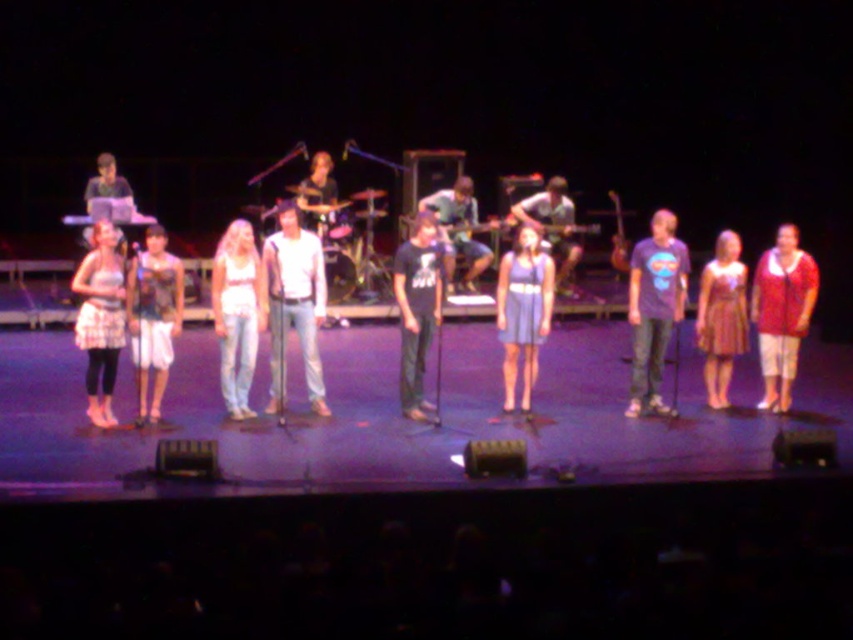
Question: Which object appears closest to the camera in this image?

Choices:
 (A) matte black guitar at center
 (B) black cotton t-shirt at center
 (C) matte purple dress at center
 (D) white textured skirt at left

Answer: (D)

Question: Which object appears closest to the camera in this image?

Choices:
 (A) white textured skirt at left
 (B) matte black tank top at left
 (C) black cotton t-shirt at center

Answer: (A)

Question: Does white denim jeans at center lie in front of matte purple dress at center?

Choices:
 (A) no
 (B) yes

Answer: (B)

Question: Does matte black guitar at center have a lesser width compared to shiny purple dress at right?

Choices:
 (A) yes
 (B) no

Answer: (B)

Question: Does matte black guitar at center have a greater width compared to shiny purple dress at right?

Choices:
 (A) no
 (B) yes

Answer: (B)

Question: Among these objects, which one is nearest to the camera?

Choices:
 (A) matte purple dress at center
 (B) shiny purple dress at right

Answer: (A)